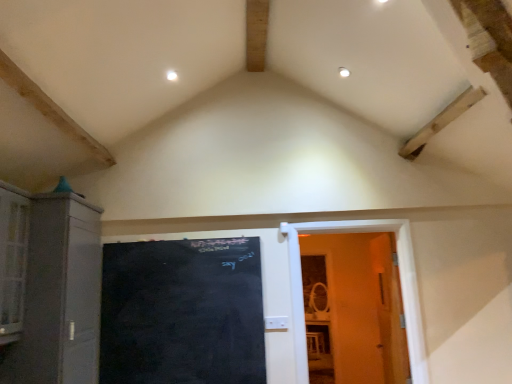
Question: Should I look upward or downward to see wooden door at right?

Choices:
 (A) up
 (B) down

Answer: (B)

Question: From the image's perspective, does black chalkboard at center appear lower than wooden door at right?

Choices:
 (A) no
 (B) yes

Answer: (B)

Question: Does black chalkboard at center have a greater height compared to wooden door at right?

Choices:
 (A) no
 (B) yes

Answer: (A)

Question: Is black chalkboard at center wider than wooden door at right?

Choices:
 (A) yes
 (B) no

Answer: (B)

Question: Is black chalkboard at center turned away from wooden door at right?

Choices:
 (A) no
 (B) yes

Answer: (A)

Question: Is the surface of black chalkboard at center in direct contact with wooden door at right?

Choices:
 (A) no
 (B) yes

Answer: (A)

Question: Is black chalkboard at center far away from wooden door at right?

Choices:
 (A) no
 (B) yes

Answer: (A)

Question: Does matte gray cabinet at left have a smaller size compared to black chalkboard at center?

Choices:
 (A) no
 (B) yes

Answer: (A)

Question: Does matte gray cabinet at left have a larger size compared to black chalkboard at center?

Choices:
 (A) no
 (B) yes

Answer: (B)

Question: Considering the relative positions of matte gray cabinet at left and black chalkboard at center in the image provided, is matte gray cabinet at left behind black chalkboard at center?

Choices:
 (A) yes
 (B) no

Answer: (B)

Question: Could you tell me if matte gray cabinet at left is turned towards black chalkboard at center?

Choices:
 (A) yes
 (B) no

Answer: (A)

Question: Would you say black chalkboard at center is part of matte gray cabinet at left's contents?

Choices:
 (A) yes
 (B) no

Answer: (B)

Question: Does matte gray cabinet at left have a lesser height compared to black chalkboard at center?

Choices:
 (A) yes
 (B) no

Answer: (B)

Question: Is wooden door at right touching black chalkboard at center?

Choices:
 (A) yes
 (B) no

Answer: (B)